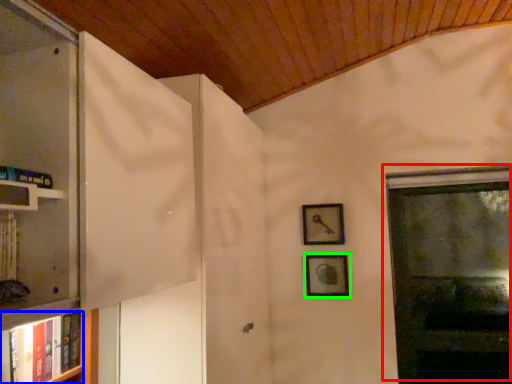
Question: Estimate the real-world distances between objects in this image. Which object is closer to window (highlighted by a red box), book (highlighted by a blue box) or picture frame (highlighted by a green box)?

Choices:
 (A) book
 (B) picture frame

Answer: (B)